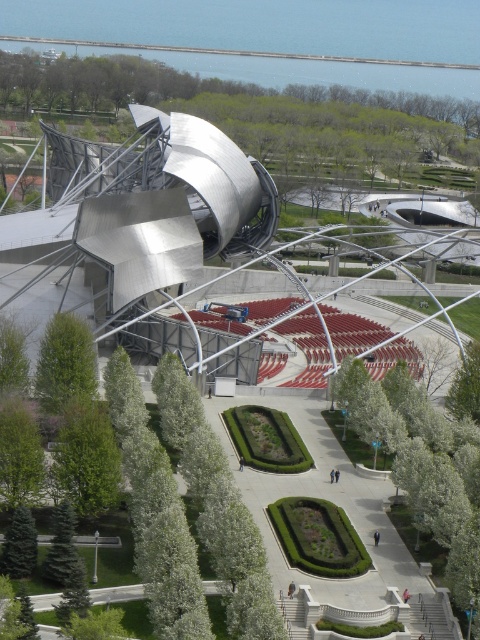
Does green leafy tree at center appear on the right side of green leafy tree at lower left?

Indeed, green leafy tree at center is positioned on the right side of green leafy tree at lower left.

Does green leafy tree at center have a lesser height compared to green leafy tree at lower left?

No, green leafy tree at center is not shorter than green leafy tree at lower left.

Which is in front, point (464, 438) or point (60, 369)?

Point (464, 438) is more forward.

Locate an element on the screen. green leafy tree at center is located at coordinates (444, 474).